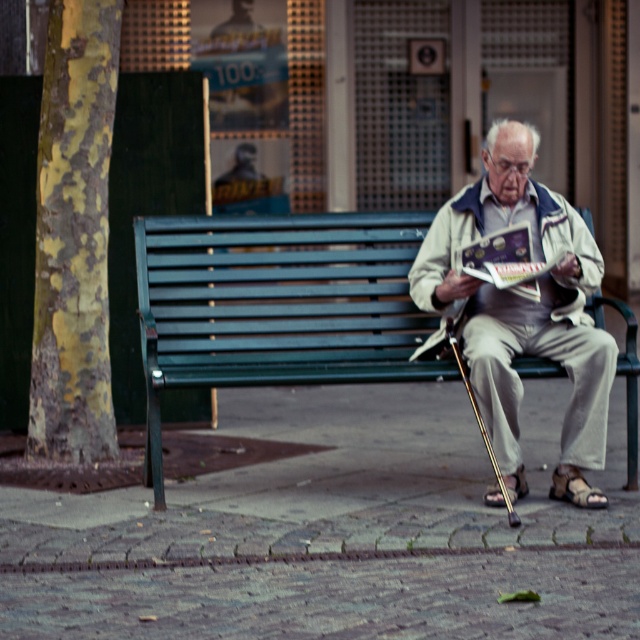
You are a tailor who needs to measure the distance between the beige fabric jacket at center and the matte paper book at center for a custom fit. Can you confirm if the space between them is more than 15 centimeters?

The distance between the beige fabric jacket at center and the matte paper book at center is 17.18 centimeters, which is more than 15 centimeters. Therefore, the space between them is sufficient.

You are a photographer trying to capture the elderly man reading his book. You want to ensure the beige fabric jacket at center and the matte paper book at center are both in focus. Which object should you position closer to the camera to achieve this?

To ensure both the beige fabric jacket at center and the matte paper book at center are in focus, position the beige fabric jacket at center closer to the camera since it is to the right of the matte paper book at center, adjusting the depth of field accordingly.

You are standing in the urban scene and want to hand the beige fabric jacket at center to the elderly man sitting on the green metal bench. Can you reach him without moving from your current position?

The beige fabric jacket at center is 7.48 meters from viewer, so you cannot reach the elderly man sitting on the green metal bench without moving closer as the distance is too far.